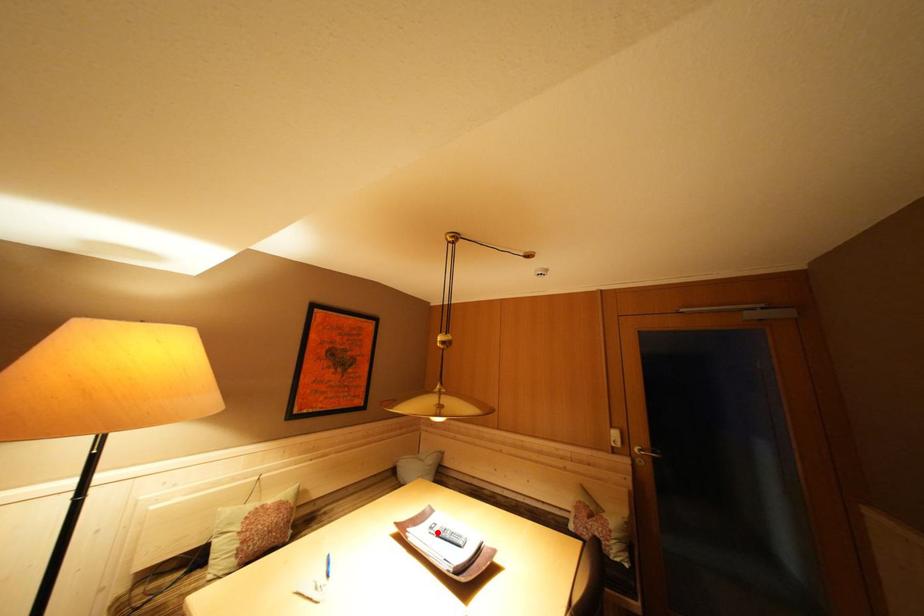
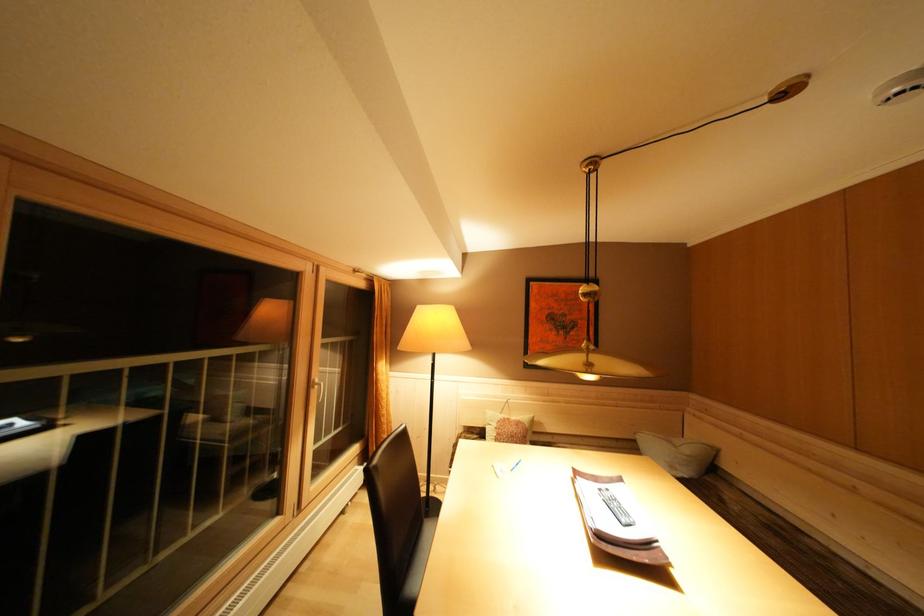
Where in the second image is the point corresponding to the highlighted location from the first image?

(608, 495)